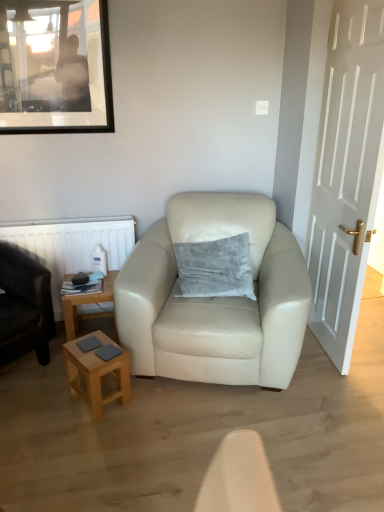
Question: Considering the relative sizes of matte black picture frame at upper left and light brown wooden stool at lower left in the image provided, is matte black picture frame at upper left bigger than light brown wooden stool at lower left?

Choices:
 (A) yes
 (B) no

Answer: (A)

Question: Is the surface of matte black picture frame at upper left in direct contact with light brown wooden stool at lower left?

Choices:
 (A) no
 (B) yes

Answer: (A)

Question: Does matte black picture frame at upper left have a smaller size compared to light brown wooden stool at lower left?

Choices:
 (A) no
 (B) yes

Answer: (A)

Question: Are matte black picture frame at upper left and light brown wooden stool at lower left far apart?

Choices:
 (A) no
 (B) yes

Answer: (B)

Question: Is matte black picture frame at upper left at the right side of light brown wooden stool at lower left?

Choices:
 (A) yes
 (B) no

Answer: (B)

Question: From a real-world perspective, is matte black picture frame at upper left above or below woodenwoodentable at lower left?

Choices:
 (A) above
 (B) below

Answer: (A)

Question: Considering the relative positions of matte black picture frame at upper left and woodenwoodentable at lower left in the image provided, is matte black picture frame at upper left to the left or to the right of woodenwoodentable at lower left?

Choices:
 (A) left
 (B) right

Answer: (A)

Question: Is matte black picture frame at upper left taller or shorter than woodenwoodentable at lower left?

Choices:
 (A) tall
 (B) short

Answer: (A)

Question: Do you think matte black picture frame at upper left is within woodenwoodentable at lower left, or outside of it?

Choices:
 (A) inside
 (B) outside

Answer: (B)

Question: From the image's perspective, is white plastic radiator at left located above or below matte black picture frame at upper left?

Choices:
 (A) above
 (B) below

Answer: (B)

Question: Based on their positions, is white plastic radiator at left located to the left or right of matte black picture frame at upper left?

Choices:
 (A) right
 (B) left

Answer: (A)

Question: Looking at the image, does white plastic radiator at left seem bigger or smaller compared to matte black picture frame at upper left?

Choices:
 (A) big
 (B) small

Answer: (A)

Question: Is white plastic radiator at left inside the boundaries of matte black picture frame at upper left, or outside?

Choices:
 (A) outside
 (B) inside

Answer: (A)

Question: From a real-world perspective, relative to woodenwoodentable at lower left, is white wooden door at right vertically above or below?

Choices:
 (A) below
 (B) above

Answer: (B)

Question: Is white wooden door at right to the left or to the right of woodenwoodentable at lower left in the image?

Choices:
 (A) left
 (B) right

Answer: (B)